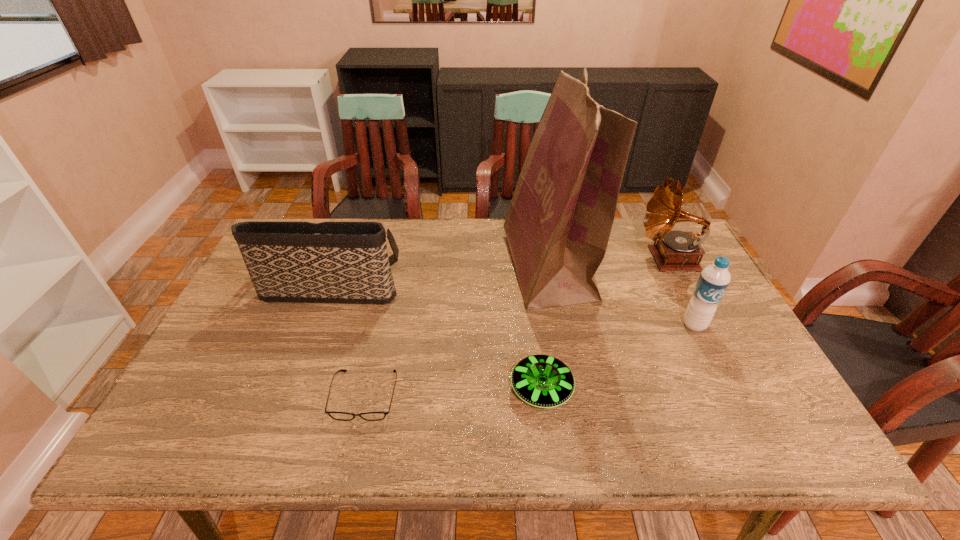
The width and height of the screenshot is (960, 540). I want to click on grocery bag, so 558,225.

Where is `phonograph_record`? The image size is (960, 540). phonograph_record is located at coordinates (675, 250).

You are a GUI agent. You are given a task and a screenshot of the screen. Output one action in this format:
    pyautogui.click(x=<x>, y=<y>)
    Task: Click on the handbag
    Image resolution: width=960 pixels, height=540 pixels.
    Given the screenshot: What is the action you would take?
    pyautogui.click(x=329, y=262)

Find the location of a particular element. The height and width of the screenshot is (540, 960). the third nearest object is located at coordinates (714, 279).

The width and height of the screenshot is (960, 540). I want to click on saucer, so click(544, 381).

The width and height of the screenshot is (960, 540). What are the coordinates of `the shortest object` in the screenshot? It's located at (343, 416).

Where is `vacant space located 0.170m on the front-facing side of the tallest object`? The height and width of the screenshot is (540, 960). vacant space located 0.170m on the front-facing side of the tallest object is located at coordinates (450, 267).

You are a GUI agent. You are given a task and a screenshot of the screen. Output one action in this format:
    pyautogui.click(x=<x>, y=<y>)
    Task: Click on the vacant point located 0.330m on the front-facing side of the tallest object
    Image resolution: width=960 pixels, height=540 pixels.
    Given the screenshot: What is the action you would take?
    pyautogui.click(x=397, y=267)

This screenshot has height=540, width=960. In order to click on blank area located 0.060m on the front-facing side of the tallest object in this screenshot , I will do `click(486, 267)`.

This screenshot has height=540, width=960. In order to click on blank area located 0.270m on the horn of the phonograph_record in this screenshot , I will do `click(553, 259)`.